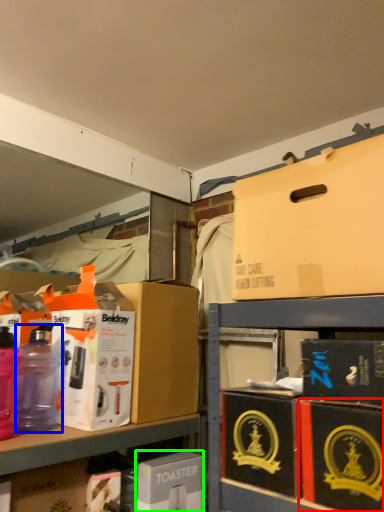
Question: Considering the real-world distances, which object is farthest from box (highlighted by a red box)? bottle (highlighted by a blue box) or box (highlighted by a green box)?

Choices:
 (A) bottle
 (B) box

Answer: (A)